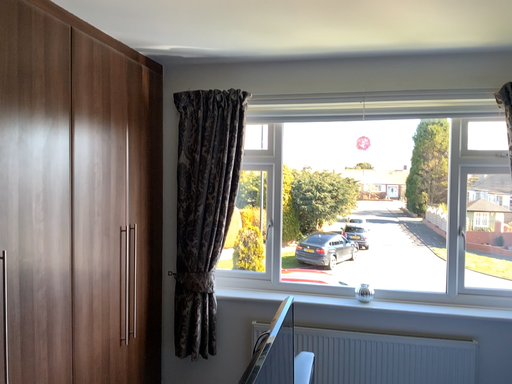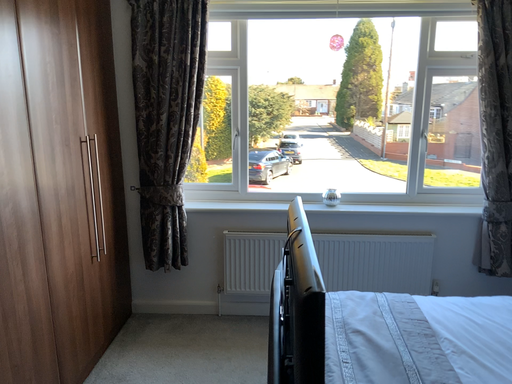
Question: How did the camera likely rotate when shooting the video?

Choices:
 (A) rotated left
 (B) rotated right

Answer: (B)